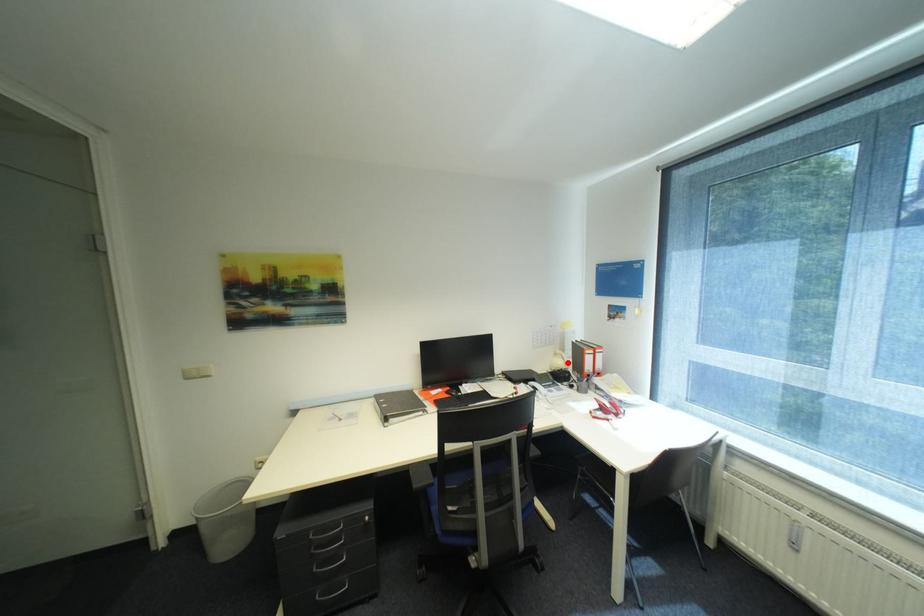
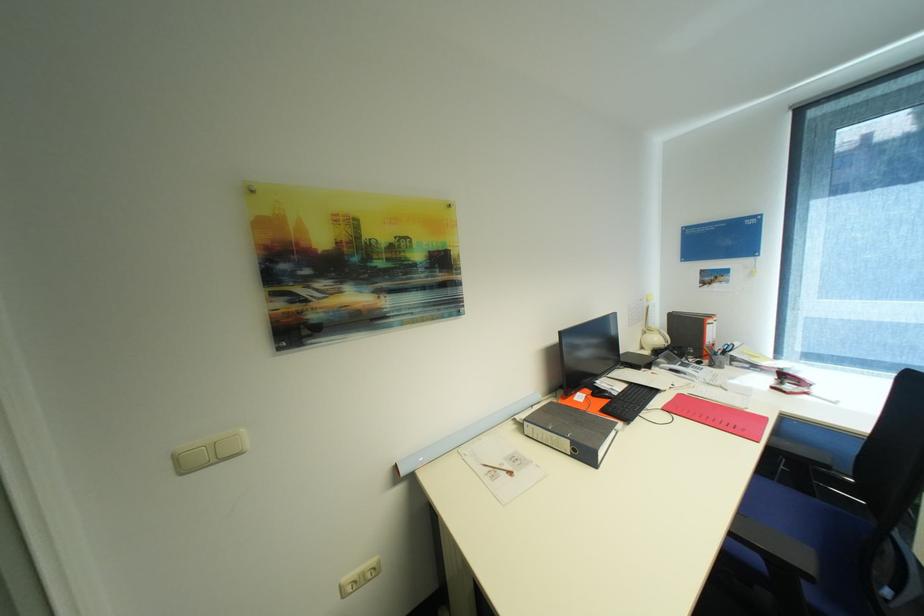
Find the pixel in the second image that matches the highlighted location in the first image.

(663, 339)